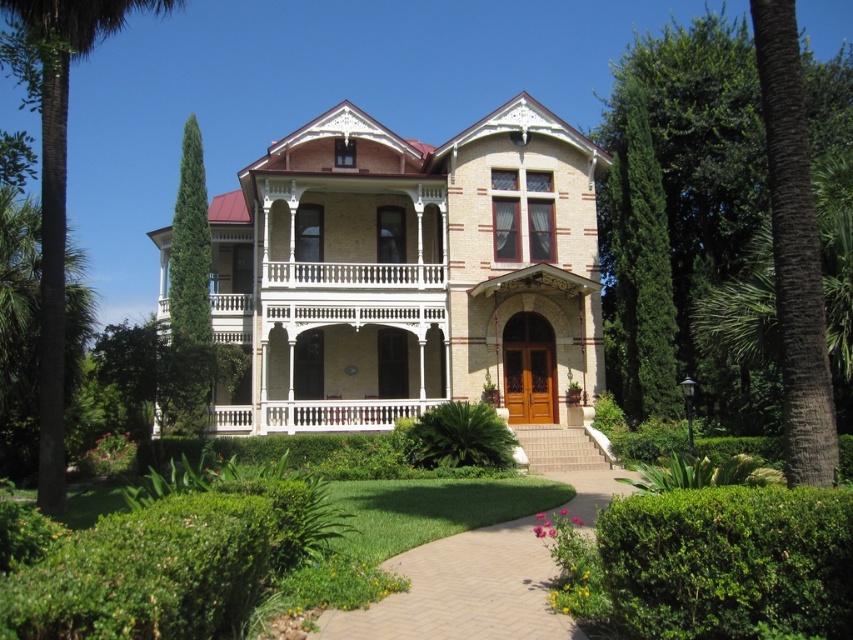
Question: Among these objects, which one is nearest to the camera?

Choices:
 (A) green leafy tree at right
 (B) white wood porch at center
 (C) green leafy palm tree at left

Answer: (A)

Question: Does green leafy palm tree at left appear over white wood porch at center?

Choices:
 (A) yes
 (B) no

Answer: (A)

Question: Considering the relative positions of green leafy palm tree at left and white wood porch at center in the image provided, where is green leafy palm tree at left located with respect to white wood porch at center?

Choices:
 (A) left
 (B) right

Answer: (A)

Question: In this image, where is green leafy tree at right located relative to green leafy palm tree at left?

Choices:
 (A) left
 (B) right

Answer: (B)

Question: Estimate the real-world distances between objects in this image. Which object is farther from the brick pathway at center?

Choices:
 (A) green leafy palm tree at left
 (B) white wood porch at center

Answer: (A)

Question: Among these points, which one is nearest to the camera?

Choices:
 (A) (836, 380)
 (B) (3, 1)
 (C) (254, 406)

Answer: (B)